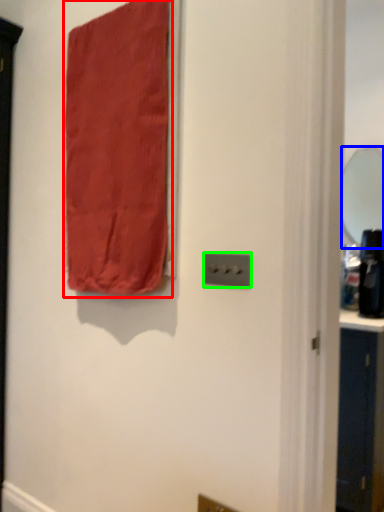
Question: Which object is positioned closest to curtain (highlighted by a red box)? Select from mirror (highlighted by a blue box) and light switch (highlighted by a green box).

Choices:
 (A) mirror
 (B) light switch

Answer: (B)